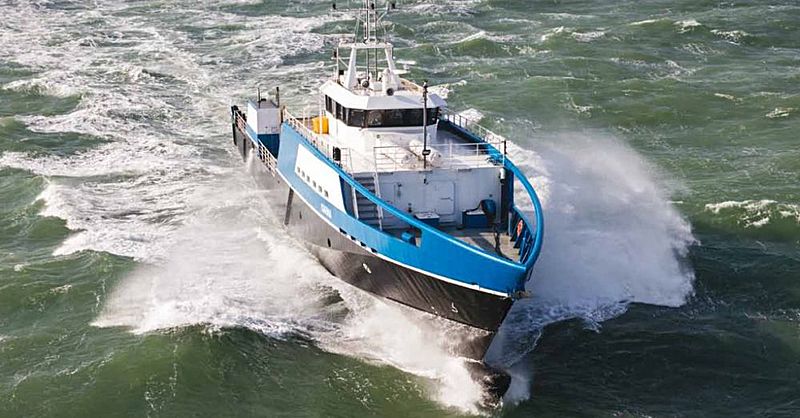
Locate an element on the screen. The image size is (800, 418). windows is located at coordinates (401, 117).